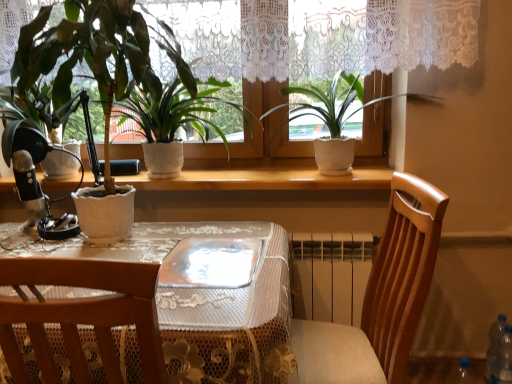
Locate an element on the screen. The height and width of the screenshot is (384, 512). vacant space in white textured pot at center, which is counted as the 2th houseplant, starting from the right (from a real-world perspective) is located at coordinates (197, 174).